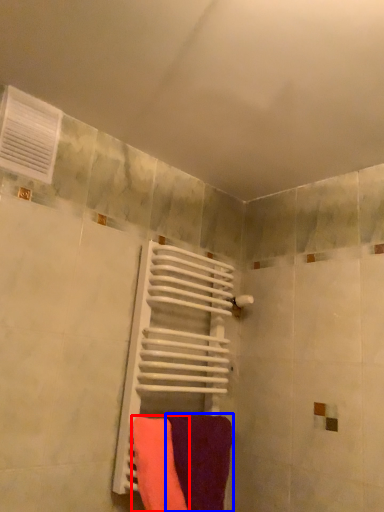
Question: Among these objects, which one is farthest to the camera, towel (highlighted by a red box) or towel (highlighted by a blue box)?

Choices:
 (A) towel
 (B) towel

Answer: (B)